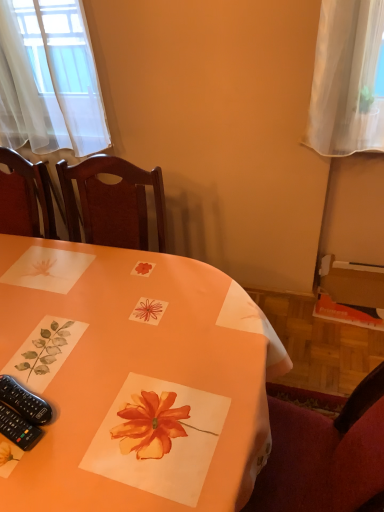
Question: From their relative heights in the image, would you say black plastic remote control at lower left, the first remote control positioned from the bottom, is taller or shorter than orange paper placemat at center?

Choices:
 (A) tall
 (B) short

Answer: (B)

Question: Is point (8, 423) positioned closer to the camera than point (119, 328)?

Choices:
 (A) farther
 (B) closer

Answer: (B)

Question: Which is nearer to the orange paper placemat at center?

Choices:
 (A) black plastic remote control at lower left, positioned as the second remote control in top-to-bottom order
 (B) black plastic remote control at lower left, which is counted as the first remote control, starting from the top

Answer: (B)

Question: Based on their relative distances, which object is farther from the orange paper placemat at center?

Choices:
 (A) black plastic remote control at lower left, the first remote control positioned from the bottom
 (B) black plastic remote control at lower left, which is counted as the first remote control, starting from the top

Answer: (A)